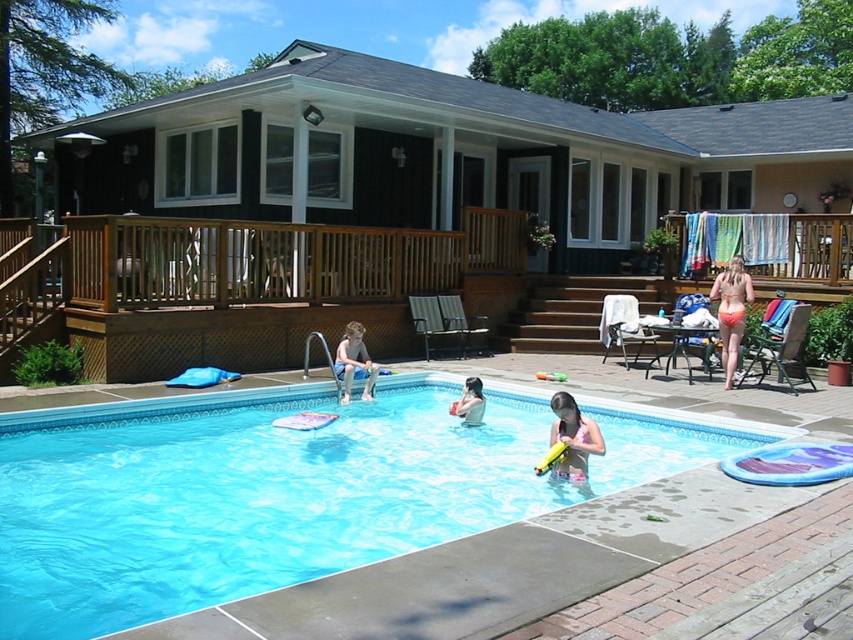
Measure the distance between pink rubber at lower right and orange bikini at right.

3.73 meters

Is pink rubber at lower right positioned in front of orange bikini at right?

Yes, it is.

Which is in front, point (592, 438) or point (746, 294)?

Point (592, 438)

This screenshot has width=853, height=640. I want to click on pink rubber at lower right, so click(573, 438).

Between blue tile swimming pool at center and wooden deck at center, which one has less height?

blue tile swimming pool at center is shorter.

Is point (323, 403) behind point (90, 221)?

That is False.

This screenshot has width=853, height=640. Find the location of `blue tile swimming pool at center`. blue tile swimming pool at center is located at coordinates (322, 508).

Can you confirm if blue tile swimming pool at center is bigger than pink rubber at lower right?

No, blue tile swimming pool at center is not bigger than pink rubber at lower right.

Is blue tile swimming pool at center to the left of pink rubber at lower right from the viewer's perspective?

Yes, blue tile swimming pool at center is to the left of pink rubber at lower right.

Between point (653, 467) and point (550, 403), which one is positioned behind?

The point (550, 403) is behind.

At what (x,y) coordinates should I click in order to perform the action: click on blue tile swimming pool at center. Please return your answer as a coordinate pair (x, y). This screenshot has height=640, width=853. Looking at the image, I should click on (322, 508).